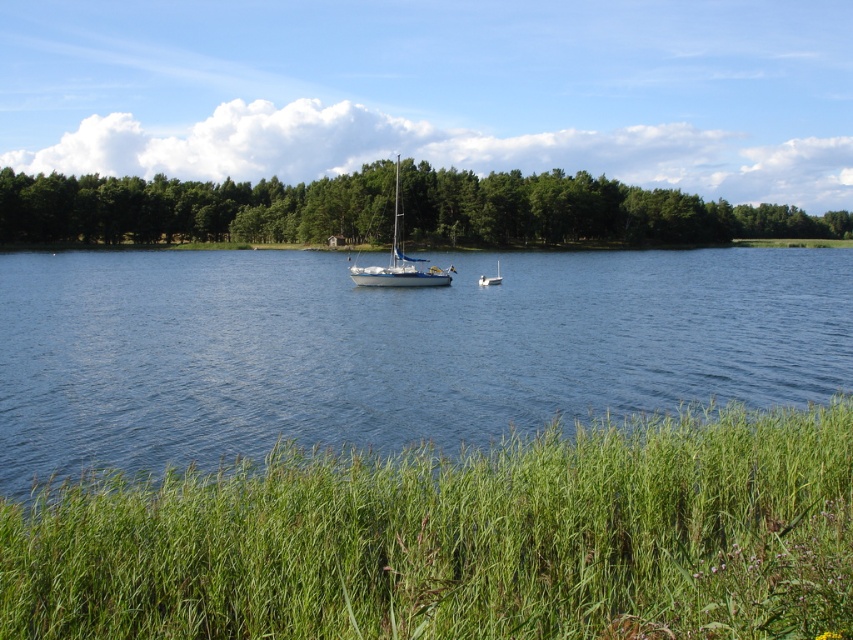
Question: Among these points, which one is farthest from the camera?

Choices:
 (A) (486, 280)
 (B) (395, 276)
 (C) (68, 312)

Answer: (A)

Question: Does blue water at center appear over green leafy trees at upper center?

Choices:
 (A) yes
 (B) no

Answer: (B)

Question: Among these objects, which one is nearest to the camera?

Choices:
 (A) green leafy trees at upper center
 (B) white glossy sailboat at center

Answer: (B)

Question: Is white glossy sailboat at center below white glossy boat at center?

Choices:
 (A) yes
 (B) no

Answer: (B)

Question: Where is blue water at center located in relation to white glossy sailboat at center in the image?

Choices:
 (A) above
 (B) below

Answer: (B)

Question: Which object is closer to the camera taking this photo?

Choices:
 (A) blue water at center
 (B) white glossy sailboat at center
 (C) green leafy trees at upper center
 (D) white glossy boat at center

Answer: (A)